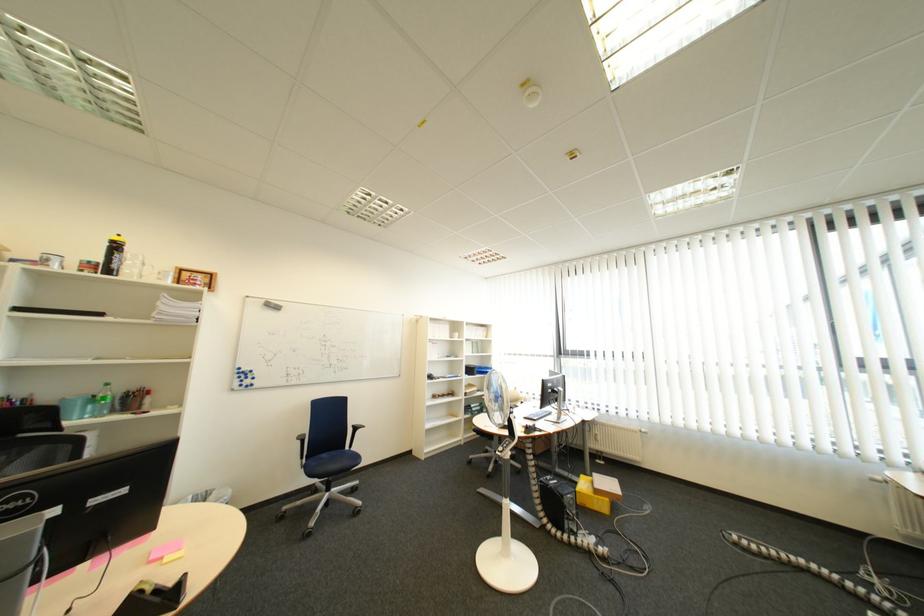
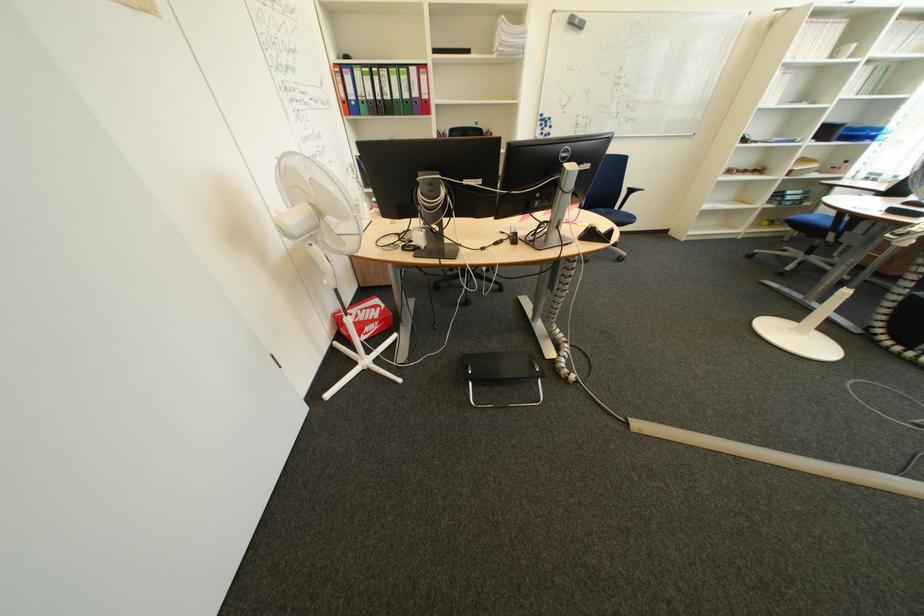
In the second image, find the point that corresponds to [277,309] in the first image.

(581, 28)